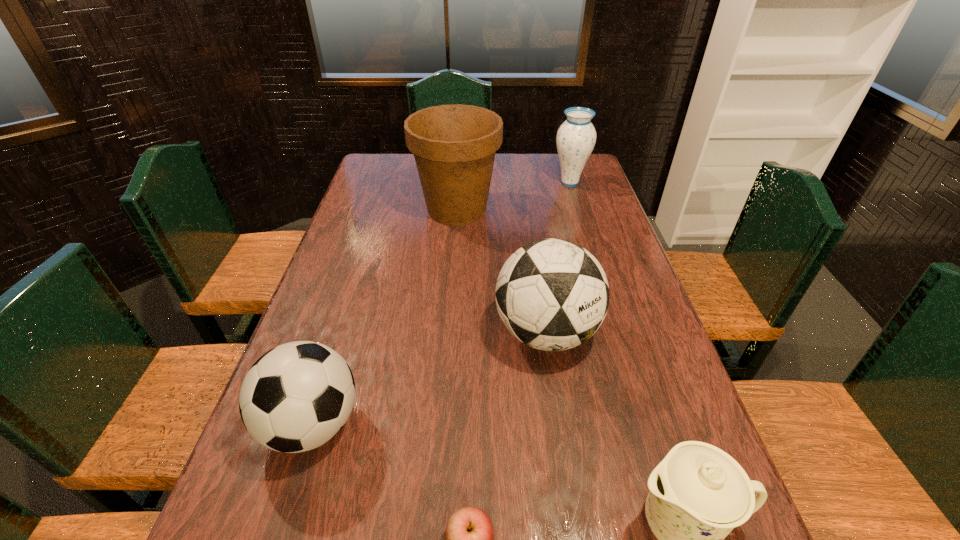
This screenshot has height=540, width=960. Identify the location of object that is at the far edge. (576, 137).

The width and height of the screenshot is (960, 540). Identify the location of object positioned at the left edge. (296, 397).

Locate an element on the screen. This screenshot has height=540, width=960. vase at the right edge is located at coordinates (576, 137).

Where is `soccer ball located at the right edge`? soccer ball located at the right edge is located at coordinates (552, 294).

What are the coordinates of `object positioned at the far right corner` in the screenshot? It's located at (576, 137).

Where is `free space at the far edge of the desktop`? Image resolution: width=960 pixels, height=540 pixels. free space at the far edge of the desktop is located at coordinates point(515,162).

In the image, there is a desktop. Where is `free space at the left edge`? This screenshot has height=540, width=960. free space at the left edge is located at coordinates pyautogui.click(x=288, y=496).

Find the location of a particular element. Image resolution: width=960 pixels, height=540 pixels. vacant space at the right edge is located at coordinates (649, 318).

What are the coordinates of `vacant region at the far left corner of the desktop` in the screenshot? It's located at (373, 154).

Where is `unoccupied position between the leftmost object and the flowerpot`? This screenshot has width=960, height=540. unoccupied position between the leftmost object and the flowerpot is located at coordinates (385, 317).